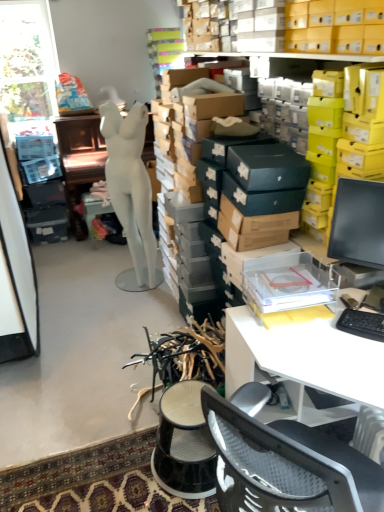
This screenshot has height=512, width=384. I want to click on free region under black plastic keyboard at right (from a real-world perspective), so click(x=365, y=325).